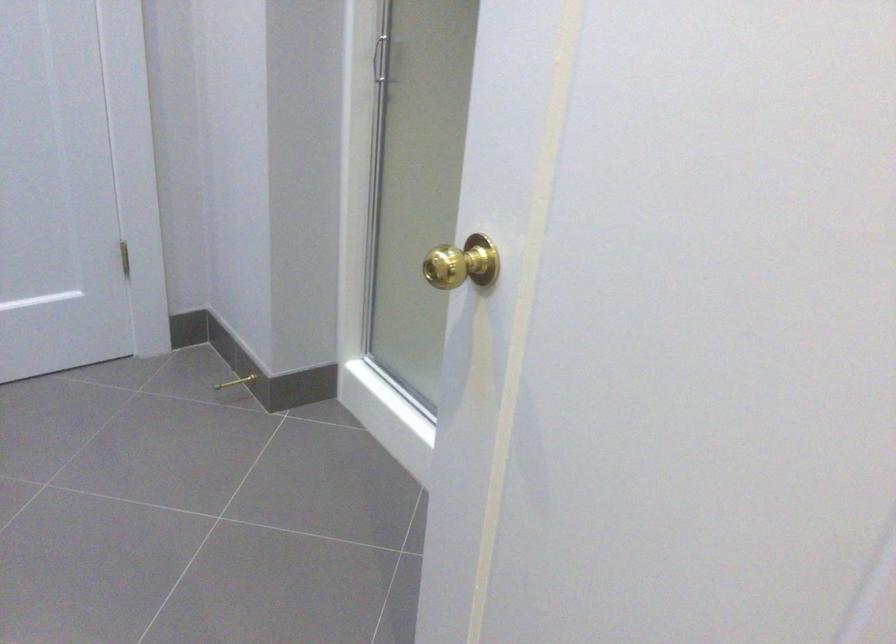
Locate an element on the screen. This screenshot has height=644, width=896. brass door knob is located at coordinates (461, 263).